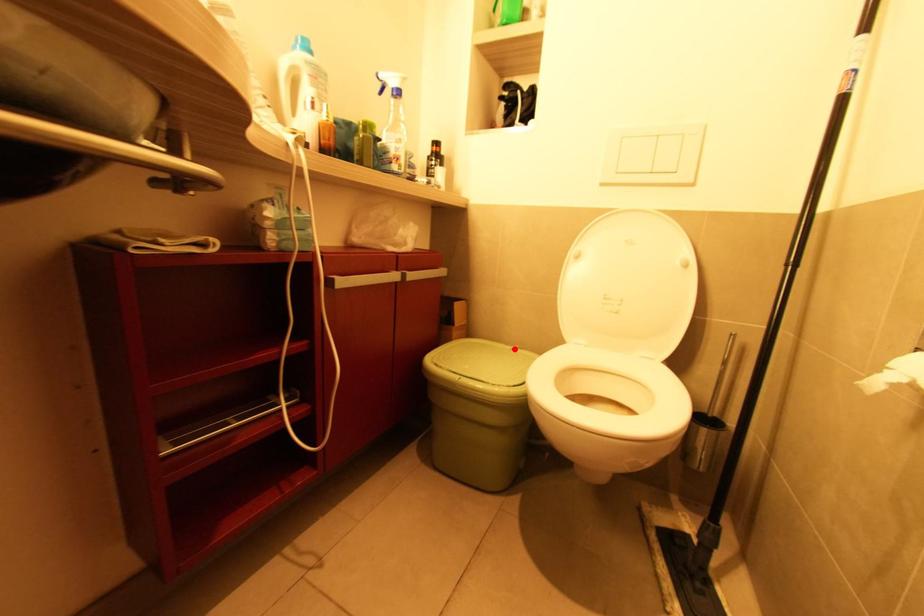
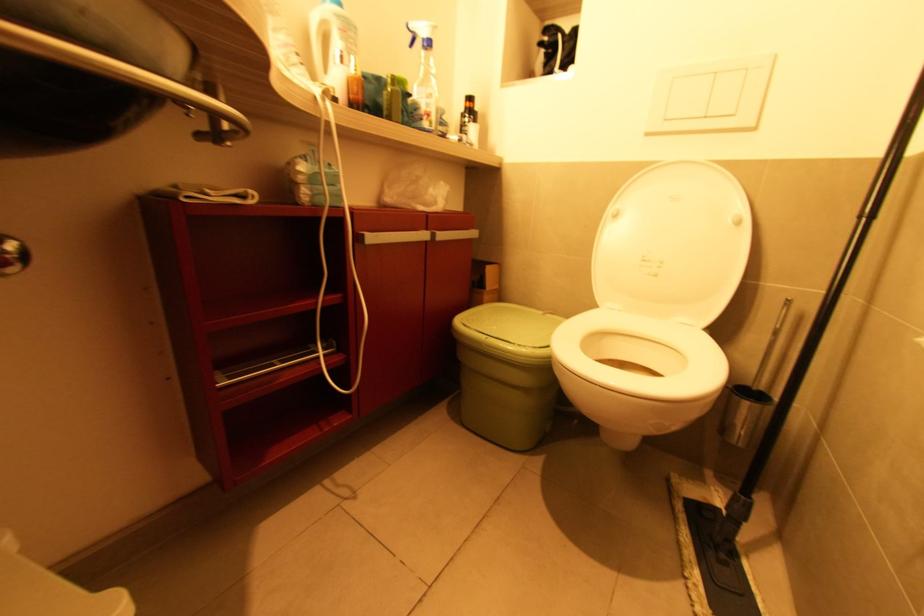
Find the pixel in the second image that matches the highlighted location in the first image.

(545, 314)